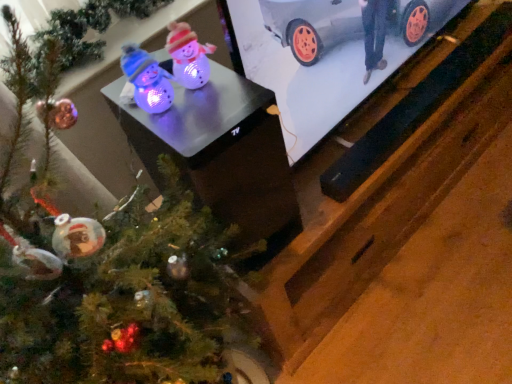
You are a GUI agent. You are given a task and a screenshot of the screen. Output one action in this format:
    pyautogui.click(x=<x>, y=<y>)
    Task: Click on the empty space that is ontop of matte plastic table at center (from a real-world perspective)
    This screenshot has height=384, width=512.
    Given the screenshot: What is the action you would take?
    tap(205, 100)